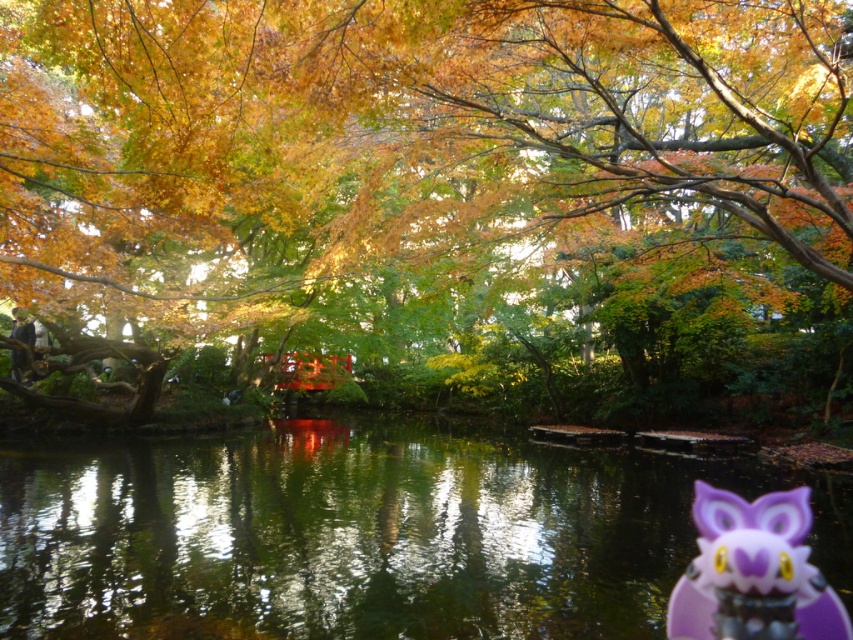
Question: Is green reflective water at center to the left of purple plastic owl at lower right from the viewer's perspective?

Choices:
 (A) no
 (B) yes

Answer: (B)

Question: Does green reflective water at center appear on the left side of purple plastic owl at lower right?

Choices:
 (A) yes
 (B) no

Answer: (A)

Question: Is green reflective water at center to the right of purple plastic owl at lower right from the viewer's perspective?

Choices:
 (A) yes
 (B) no

Answer: (B)

Question: Which point is farther to the camera?

Choices:
 (A) (746, 502)
 (B) (332, 566)

Answer: (A)

Question: Which point appears closest to the camera in this image?

Choices:
 (A) (10, 618)
 (B) (782, 554)

Answer: (A)